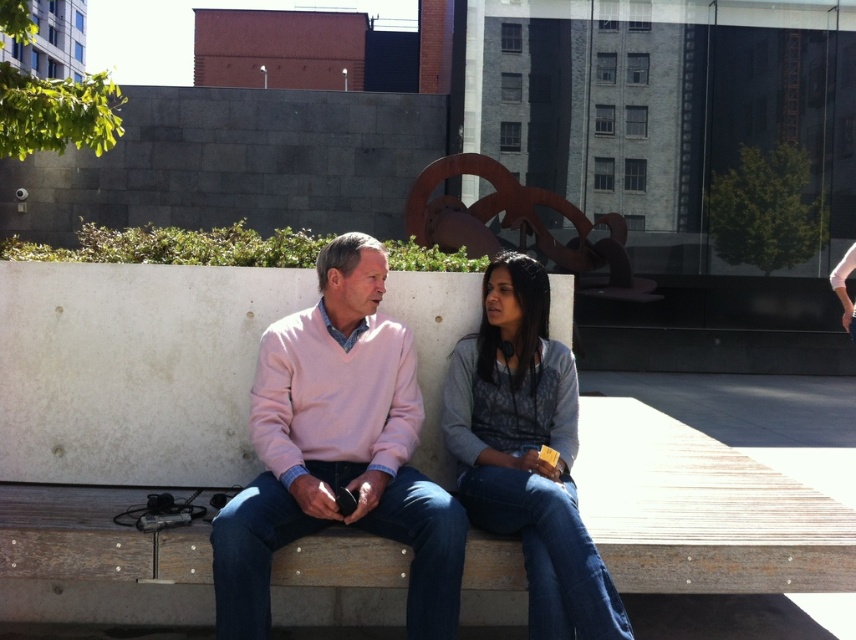
Question: Is the position of pink sweater at center less distant than that of denim jacket at center?

Choices:
 (A) no
 (B) yes

Answer: (A)

Question: Which object is closer to the camera taking this photo?

Choices:
 (A) denim jacket at center
 (B) pink sweater at center

Answer: (A)

Question: Can you confirm if pink sweater at center is positioned above denim jacket at center?

Choices:
 (A) yes
 (B) no

Answer: (A)

Question: Is pink sweater at center smaller than denim jacket at center?

Choices:
 (A) no
 (B) yes

Answer: (A)

Question: Which point is closer to the camera taking this photo?

Choices:
 (A) (214, 545)
 (B) (467, 493)

Answer: (A)